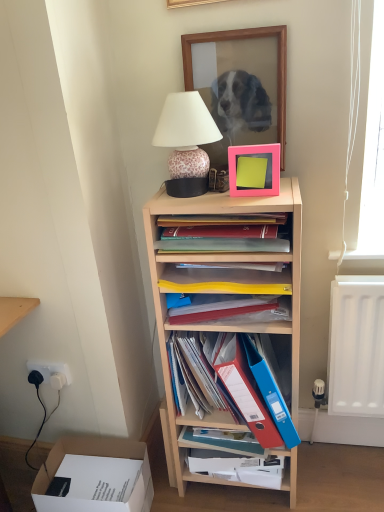
You are a GUI agent. You are given a task and a screenshot of the screen. Output one action in this format:
    pyautogui.click(x=<x>, y=<y>)
    Task: Click on the free space to the left of matte pink picture frame at upper center, the first picture frame when ordered from front to back
    Image resolution: width=384 pixels, height=512 pixels.
    Given the screenshot: What is the action you would take?
    pyautogui.click(x=209, y=198)